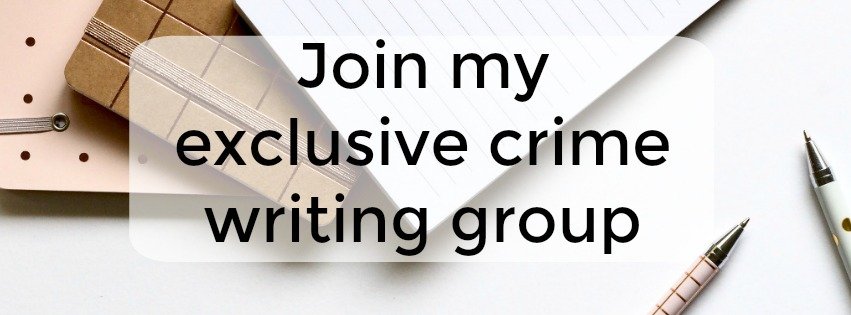
Where is `pink notebook`? This screenshot has width=851, height=315. pink notebook is located at coordinates (44, 79).